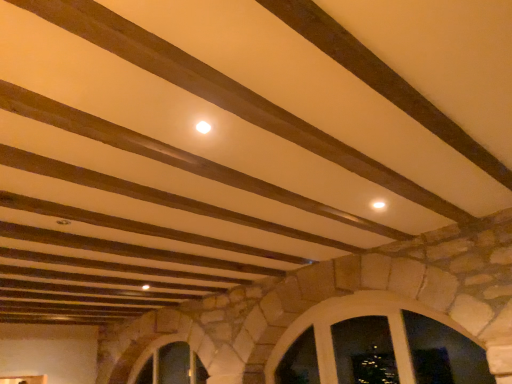
Identify the location of stone textured window at center. This screenshot has height=384, width=512. click(345, 317).

Describe the element at coordinates (345, 317) in the screenshot. The image size is (512, 384). I see `stone textured window at center` at that location.

This screenshot has width=512, height=384. I want to click on stone textured window at center, so click(345, 317).